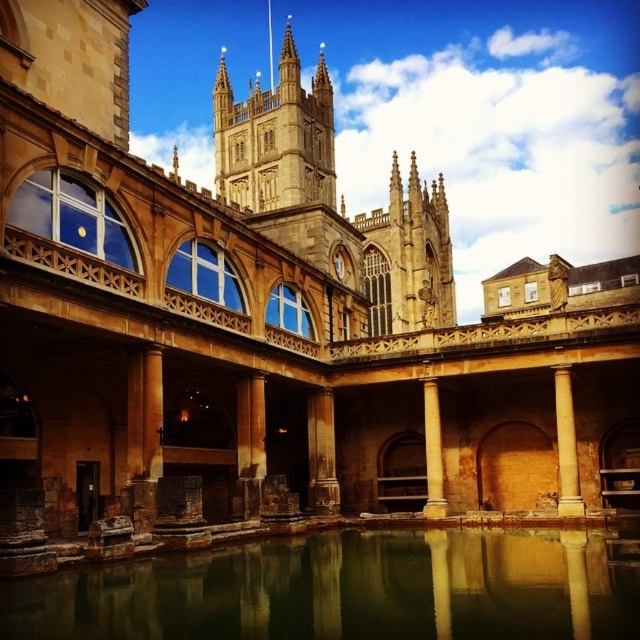
Question: Which object is closer to the camera taking this photo?

Choices:
 (A) smooth stone column at center
 (B) greenish stone water at center
 (C) brown stone column at center
 (D) brown stone pillar at center

Answer: (B)

Question: Is brown stone pillar at center to the left of smooth stone column at center from the viewer's perspective?

Choices:
 (A) no
 (B) yes

Answer: (B)

Question: Estimate the real-world distances between objects in this image. Which object is closer to the brown stone column at center?

Choices:
 (A) beige stone column at center
 (B) greenish stone water at center

Answer: (B)

Question: Which point is closer to the camera?

Choices:
 (A) (557, 499)
 (B) (548, 605)
 (C) (262, 387)

Answer: (B)

Question: Can you confirm if beige stone column at center is positioned below smooth stone column at center?

Choices:
 (A) yes
 (B) no

Answer: (B)

Question: Is greenish stone water at center closer to camera compared to brown stone pillar at center?

Choices:
 (A) yes
 (B) no

Answer: (A)